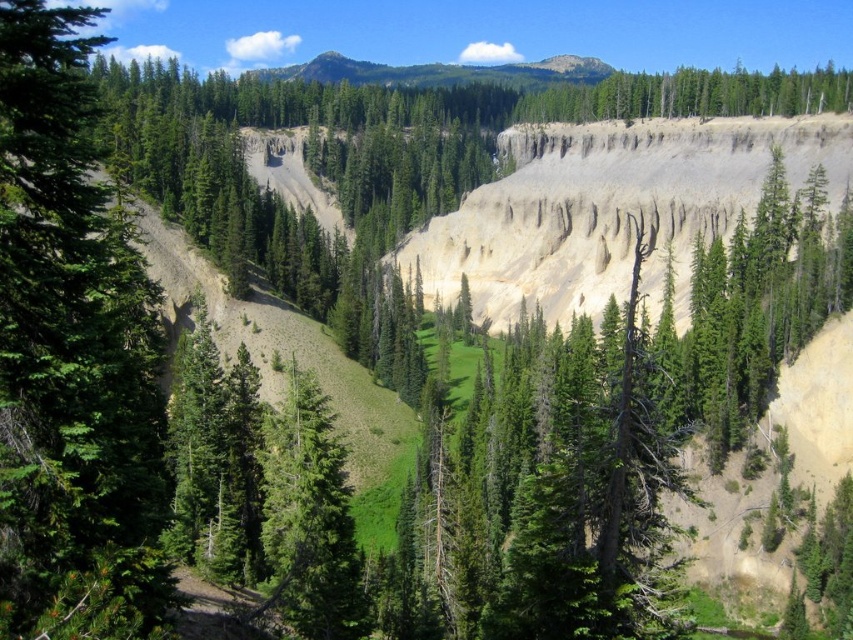
Can you confirm if green matte tree at left is positioned above green textured tree at upper center?

Actually, green matte tree at left is below green textured tree at upper center.

Who is more distant from viewer, (117, 250) or (573, 86)?

Positioned behind is point (573, 86).

Looking at this image, who is more distant from viewer, (123, 365) or (722, 88)?

Point (722, 88)

Identify the location of green matte tree at left. Image resolution: width=853 pixels, height=640 pixels. (71, 358).

What do you see at coordinates (71, 358) in the screenshot? I see `green matte tree at left` at bounding box center [71, 358].

Between green matte tree at left and green forested mountain at upper center, which one has more height?

With more height is green forested mountain at upper center.

Which is in front, point (9, 243) or point (331, 72)?

Point (9, 243)

I want to click on green matte tree at left, so coord(71,358).

Is green textured tree at upper center positioned behind green forested mountain at upper center?

No, green textured tree at upper center is closer to the viewer.

Does green textured tree at upper center appear on the left side of green forested mountain at upper center?

In fact, green textured tree at upper center is to the right of green forested mountain at upper center.

Which is in front, point (723, 115) or point (358, 67)?

Positioned in front is point (723, 115).

I want to click on green textured tree at upper center, so pyautogui.click(x=691, y=96).